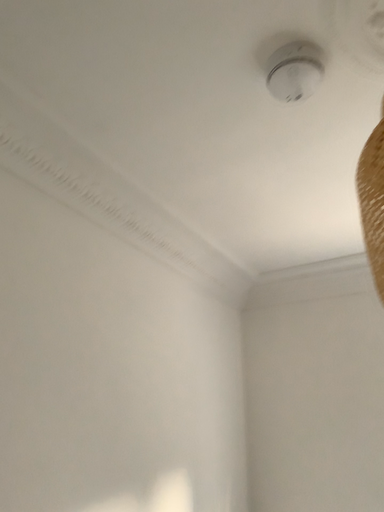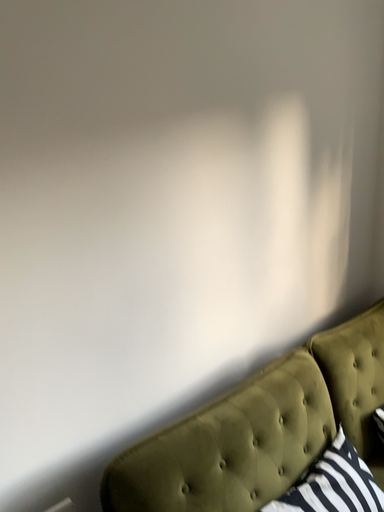
Question: How did the camera likely rotate when shooting the video?

Choices:
 (A) rotated upward
 (B) rotated downward

Answer: (B)